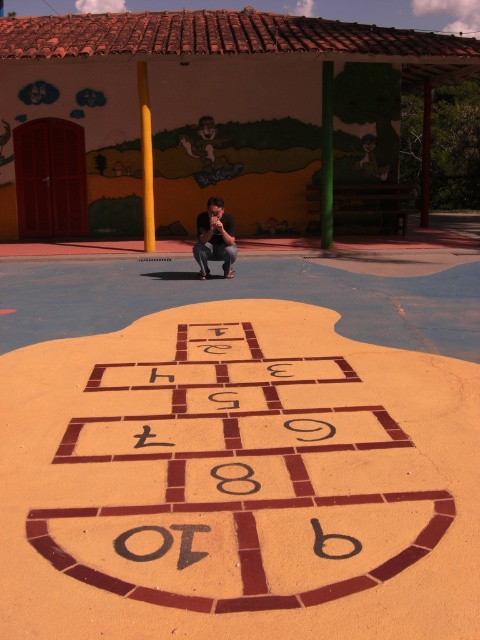
You are standing at the entrance of the playground and see the brown tile hopscotch at center and the matte black shirt at center. If you want to reach both locations, which one would you need to walk further to get to?

The brown tile hopscotch at center is 5.90 meters away from matte black shirt at center. Since you are at the entrance, it depends on their positions relative to you. However, without knowing the exact layout, we can only state the distance between them. Please provide more information about your starting point.

You are standing at the edge of the playground and want to see the brown tile hopscotch at center and the matte black shirt at center. Which object is closer to your eye level?

The matte black shirt at center is closer to your eye level because it is taller than the brown tile hopscotch at center.